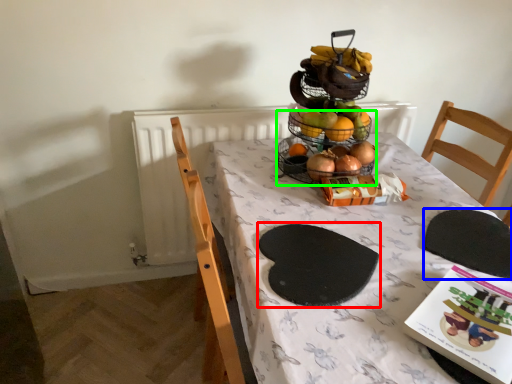
Question: Estimate the real-world distances between objects in this image. Which object is farther from mat (highlighted by a red box), mat (highlighted by a blue box) or basket (highlighted by a green box)?

Choices:
 (A) mat
 (B) basket

Answer: (B)